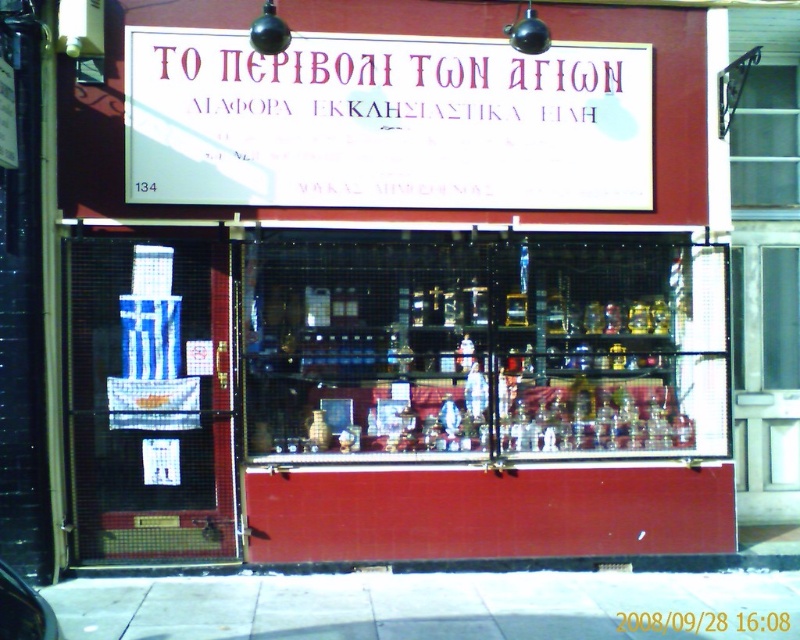
You are standing outside the shop and want to read the white paper sign at upper center. Can you see the entire sign without moving your head, considering its width relative to the white concrete pavement at lower center?

The white paper sign at upper center has a lesser width compared to the white concrete pavement at lower center, so yes, you can see the entire sign without moving your head since it is narrower than the pavement below.